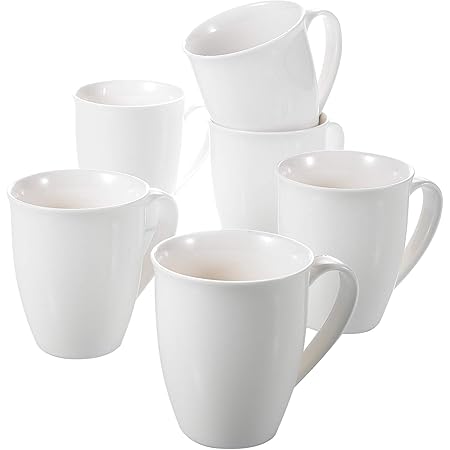
Find the location of a particular element. This screenshot has height=450, width=450. white mug is located at coordinates (285, 54), (258, 143), (351, 215), (285, 327), (97, 257), (99, 145).